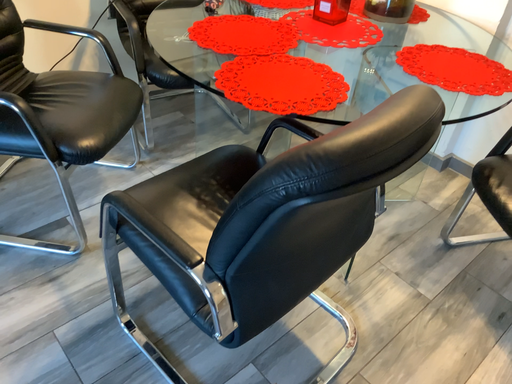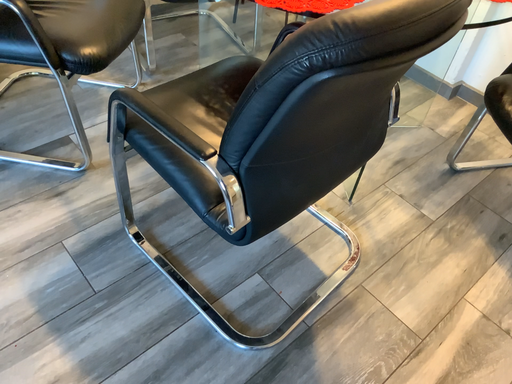
Question: Which way did the camera rotate in the video?

Choices:
 (A) rotated downward
 (B) rotated upward

Answer: (A)